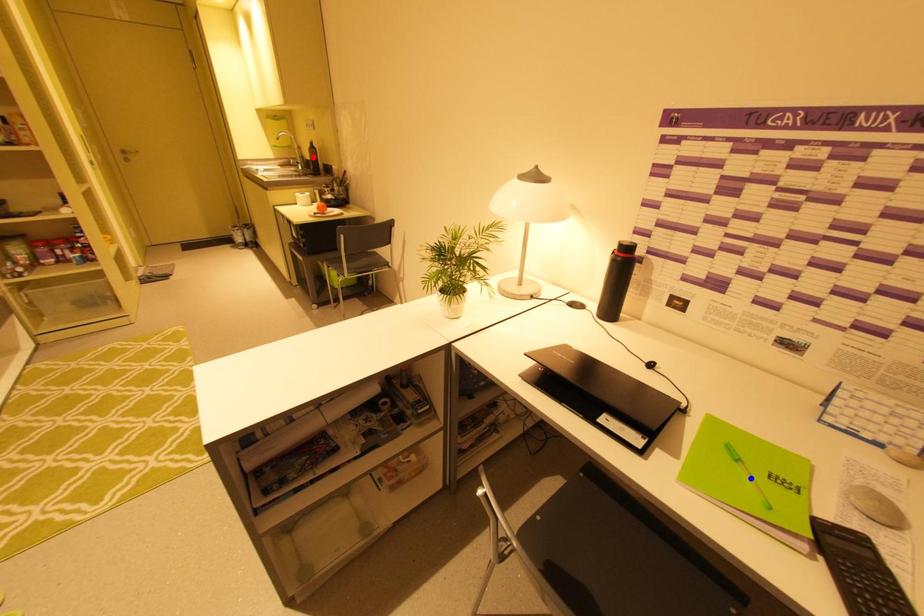
Question: Two points are marked on the image. Which point is closer to the camera?

Choices:
 (A) Blue point is closer.
 (B) Red point is closer.

Answer: (A)